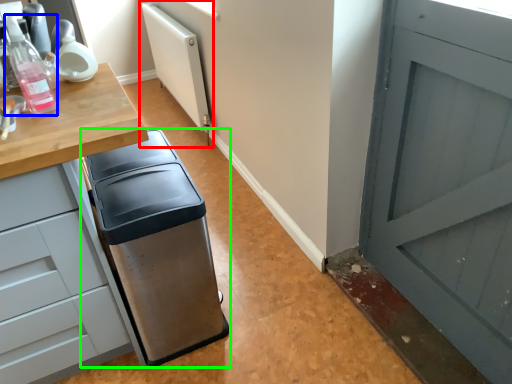
Question: Based on their relative distances, which object is farther from radiator (highlighted by a red box)? Choose from bottle (highlighted by a blue box) and waste container (highlighted by a green box).

Choices:
 (A) bottle
 (B) waste container

Answer: (A)